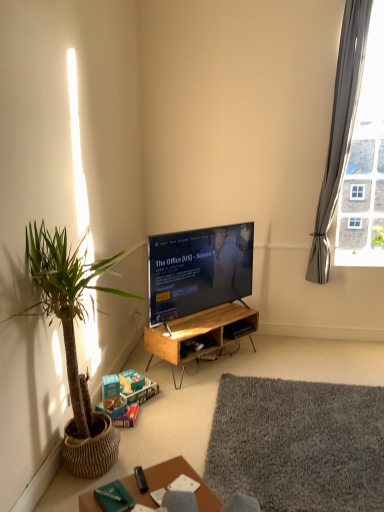
Question: Considering the relative positions of gray fabric curtain at upper right and green woven pot at left in the image provided, is gray fabric curtain at upper right to the right of green woven pot at left from the viewer's perspective?

Choices:
 (A) no
 (B) yes

Answer: (B)

Question: Is gray fabric curtain at upper right located outside green woven pot at left?

Choices:
 (A) no
 (B) yes

Answer: (B)

Question: Is gray fabric curtain at upper right not close to green woven pot at left?

Choices:
 (A) no
 (B) yes

Answer: (B)

Question: Is gray fabric curtain at upper right wider than green woven pot at left?

Choices:
 (A) no
 (B) yes

Answer: (A)

Question: Could you tell me if gray fabric curtain at upper right is turned towards green woven pot at left?

Choices:
 (A) no
 (B) yes

Answer: (A)

Question: Considering the relative sizes of gray fabric curtain at upper right and green woven pot at left in the image provided, is gray fabric curtain at upper right bigger than green woven pot at left?

Choices:
 (A) no
 (B) yes

Answer: (A)

Question: Can you see matte black tv at center touching black plastic remote control at lower center?

Choices:
 (A) yes
 (B) no

Answer: (B)

Question: From a real-world perspective, is matte black tv at center on black plastic remote control at lower center?

Choices:
 (A) yes
 (B) no

Answer: (A)

Question: Is the depth of matte black tv at center less than that of black plastic remote control at lower center?

Choices:
 (A) yes
 (B) no

Answer: (B)

Question: Considering the relative sizes of matte black tv at center and black plastic remote control at lower center in the image provided, is matte black tv at center thinner than black plastic remote control at lower center?

Choices:
 (A) no
 (B) yes

Answer: (A)

Question: From a real-world perspective, is matte black tv at center located beneath black plastic remote control at lower center?

Choices:
 (A) yes
 (B) no

Answer: (B)

Question: Could you tell me if matte black tv at center is turned towards black plastic remote control at lower center?

Choices:
 (A) yes
 (B) no

Answer: (B)

Question: Is black plastic remote control at lower center at the right side of gray fabric curtain at upper right?

Choices:
 (A) no
 (B) yes

Answer: (A)